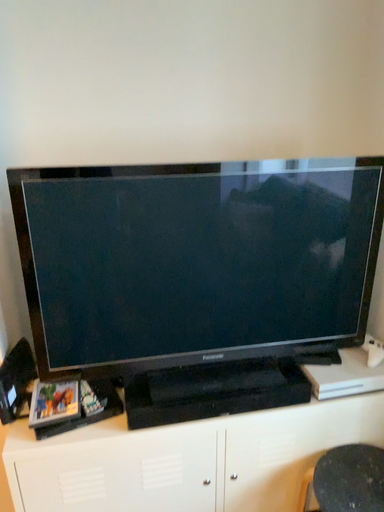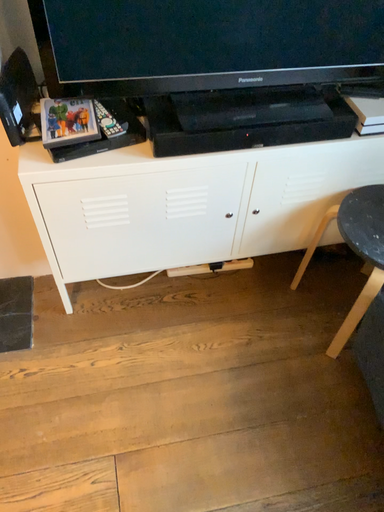
Question: How did the camera likely rotate when shooting the video?

Choices:
 (A) rotated upward
 (B) rotated downward

Answer: (B)